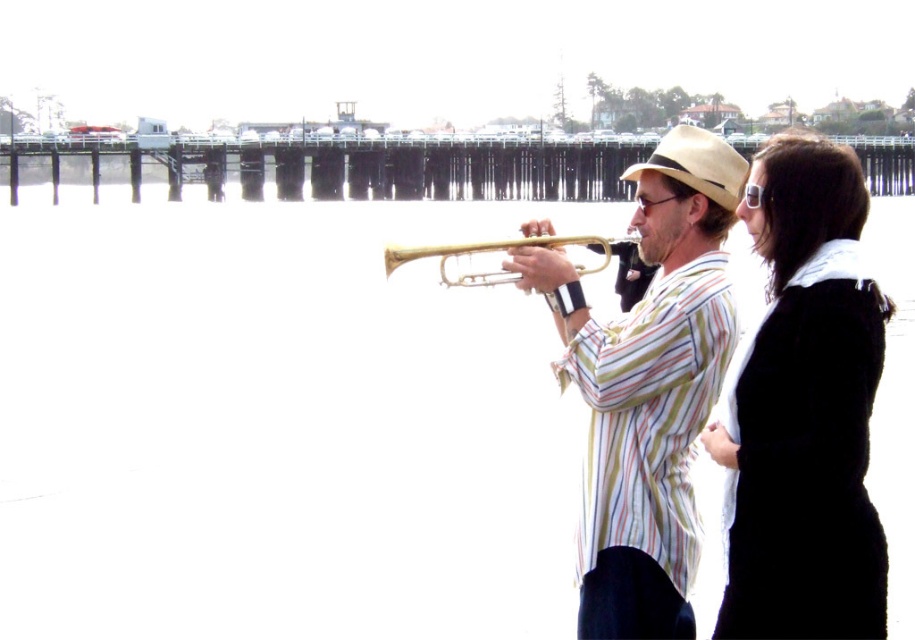
Does black velvet coat at right appear on the left side of gold shiny trumpet at center?

Incorrect, black velvet coat at right is not on the left side of gold shiny trumpet at center.

Is the position of black velvet coat at right more distant than that of gold shiny trumpet at center?

No, black velvet coat at right is in front of gold shiny trumpet at center.

You are a GUI agent. You are given a task and a screenshot of the screen. Output one action in this format:
    pyautogui.click(x=<x>, y=<y>)
    Task: Click on the black velvet coat at right
    The width and height of the screenshot is (915, 640).
    Given the screenshot: What is the action you would take?
    pyautogui.click(x=803, y=410)

Who is positioned more to the right, black velvet coat at right or gold brass trumpet at center?

black velvet coat at right

Does point (884, 310) lie behind point (479, 276)?

No, (884, 310) is closer to viewer.

This screenshot has width=915, height=640. What are the coordinates of `black velvet coat at right` in the screenshot? It's located at (803, 410).

Can you confirm if black velvet coat at right is taller than wooden pier at center?

Indeed, black velvet coat at right has a greater height compared to wooden pier at center.

Which is in front, point (765, 148) or point (362, 148)?

Point (765, 148)

What are the coordinates of `black velvet coat at right` in the screenshot? It's located at click(803, 410).